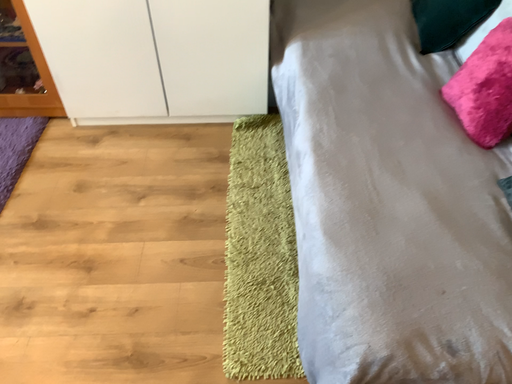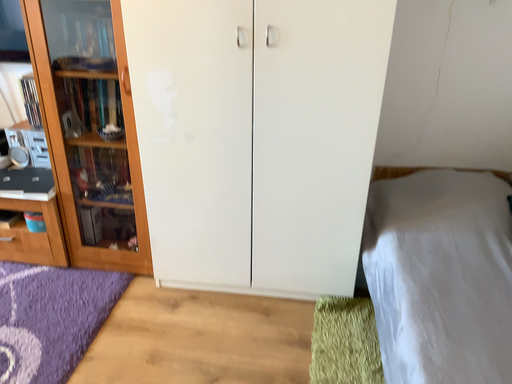
Question: How did the camera likely rotate when shooting the video?

Choices:
 (A) rotated downward
 (B) rotated upward

Answer: (B)